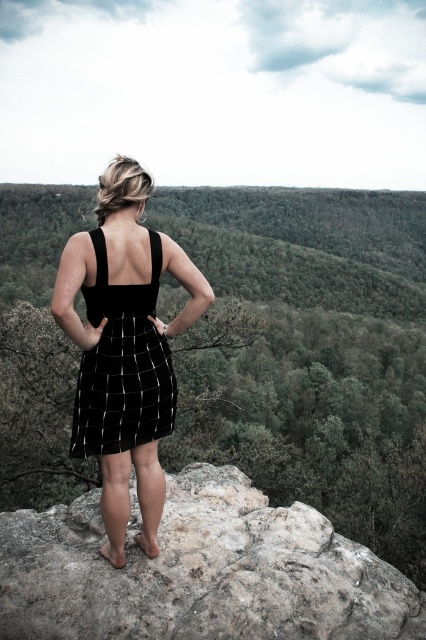
Who is more forward, (x=247, y=620) or (x=365, y=248)?

Point (x=247, y=620) is in front.

Is gray rough rock at center to the right of green leafy hillside at upper center from the viewer's perspective?

No, gray rough rock at center is not to the right of green leafy hillside at upper center.

Find the location of a particular element. The height and width of the screenshot is (640, 426). gray rough rock at center is located at coordinates (199, 572).

At what (x,y) coordinates should I click in order to perform the action: click on gray rough rock at center. Please return your answer as a coordinate pair (x, y). This screenshot has width=426, height=640. Looking at the image, I should click on (199, 572).

Is gray rough rock at center bigger than black velvet dress at center?

No, gray rough rock at center is not bigger than black velvet dress at center.

This screenshot has width=426, height=640. Describe the element at coordinates (199, 572) in the screenshot. I see `gray rough rock at center` at that location.

This screenshot has height=640, width=426. I want to click on gray rough rock at center, so click(x=199, y=572).

Does gray rough rock at center appear under black woven dress at center?

Yes, gray rough rock at center is below black woven dress at center.

Can you confirm if gray rough rock at center is positioned to the left of black woven dress at center?

No, gray rough rock at center is not to the left of black woven dress at center.

This screenshot has height=640, width=426. In order to click on gray rough rock at center in this screenshot , I will do `click(199, 572)`.